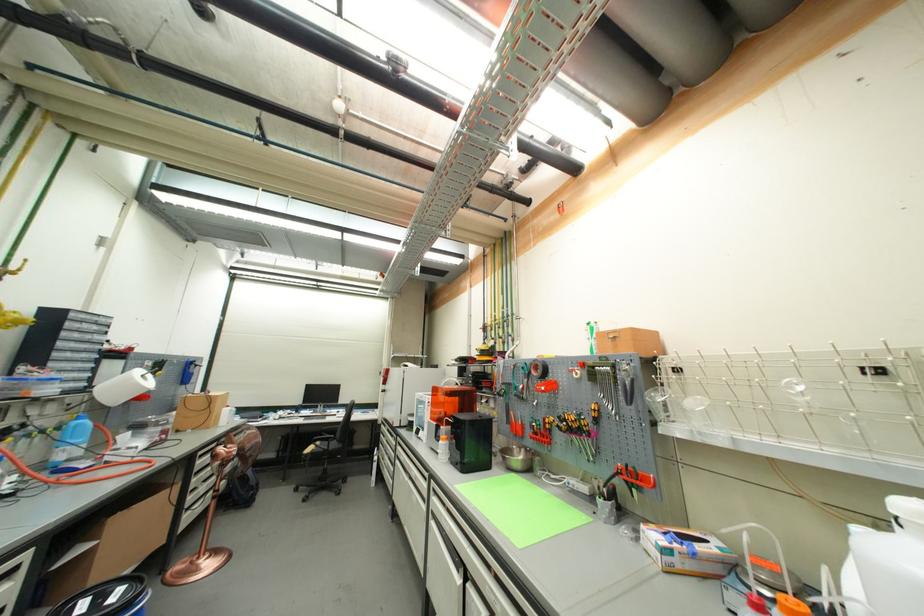
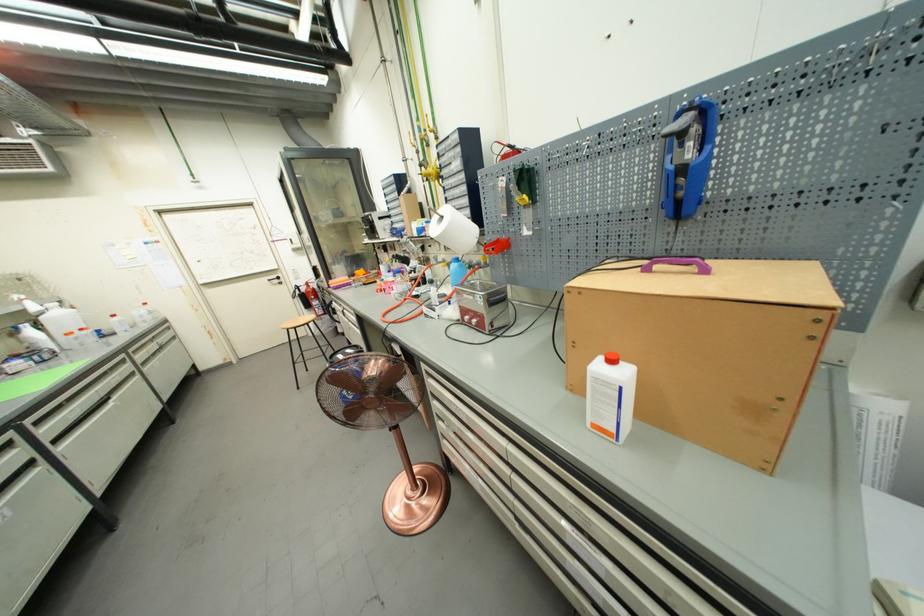
Find the pixel in the second image that matches point 234,408 in the first image.

(617, 363)